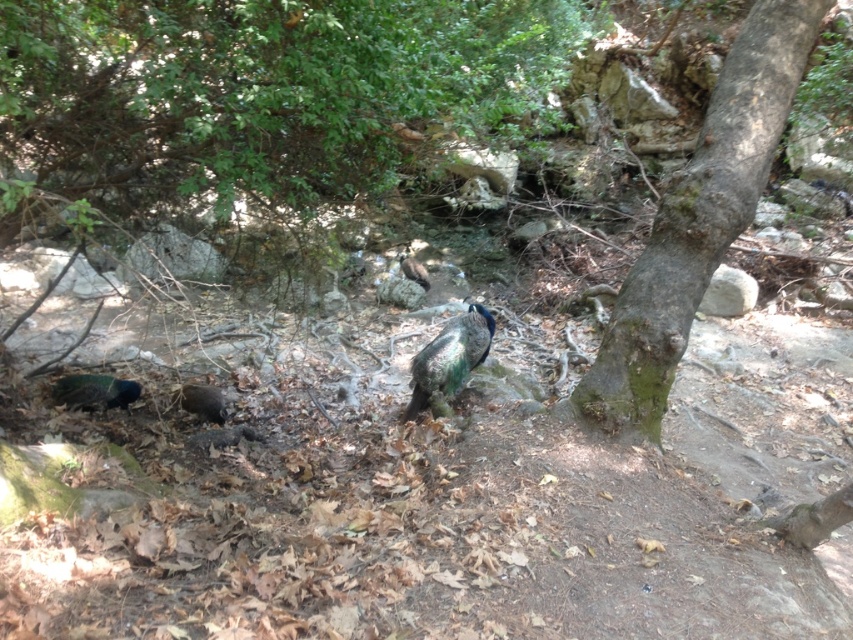
Is green mossy bark tree at center right closer to camera compared to green iridescent peacock at center?

Yes, it is.

Which is in front, point (775, 141) or point (409, 276)?

Positioned in front is point (775, 141).

This screenshot has height=640, width=853. Identify the location of green mossy bark tree at center right. (697, 221).

Between point (206, 394) and point (415, 264), which one is positioned behind?

The point (415, 264) is behind.

Is shiny black peacock at lower left smaller than green iridescent peacock at center?

Yes, shiny black peacock at lower left is smaller than green iridescent peacock at center.

Locate an element on the screen. The height and width of the screenshot is (640, 853). shiny black peacock at lower left is located at coordinates (202, 401).

Which is behind, point (608, 422) or point (102, 378)?

Point (102, 378)

Is green mossy bark tree at center right below green iridescent peacock at lower left?

No, green mossy bark tree at center right is not below green iridescent peacock at lower left.

Is point (759, 182) closer to camera compared to point (94, 403)?

Yes, it is in front of point (94, 403).

What are the coordinates of `green mossy bark tree at center right` in the screenshot? It's located at (697, 221).